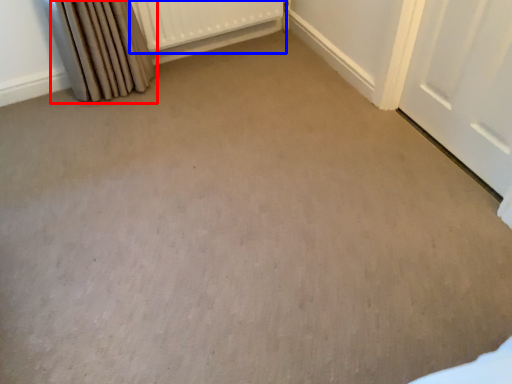
Question: Which point is closer to the camera, curtain (highlighted by a red box) or radiator (highlighted by a blue box)?

Choices:
 (A) curtain
 (B) radiator

Answer: (A)